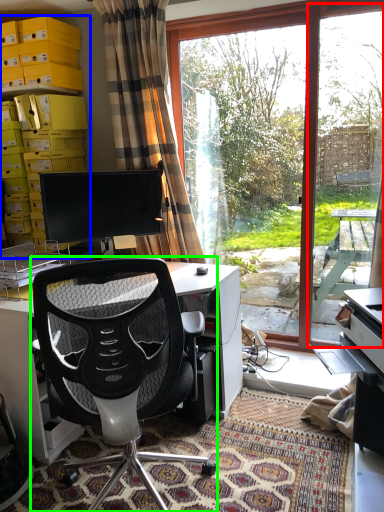
Question: Which object is the farthest from screen door (highlighted by a red box)? Choose among these: shelf (highlighted by a blue box) or chair (highlighted by a green box).

Choices:
 (A) shelf
 (B) chair

Answer: (B)